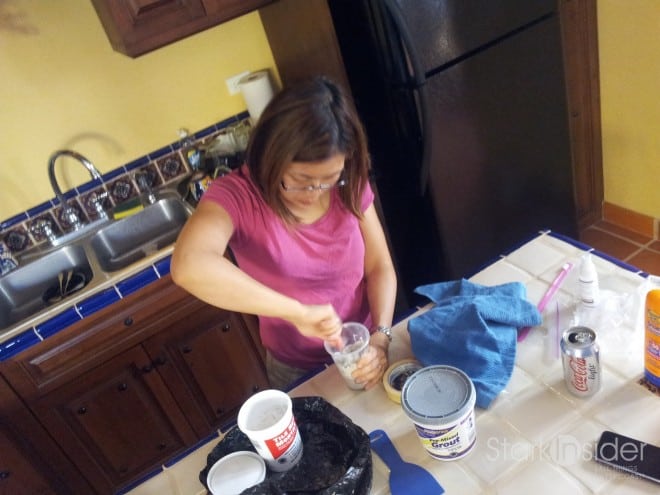
What are the coordinates of `grout buckets` in the screenshot? It's located at (430, 407), (277, 431).